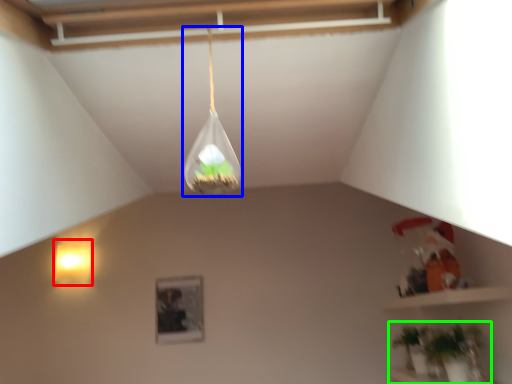
Question: Which is nearer to the lamp (highlighted by a red box)? lamp (highlighted by a blue box) or houseplant (highlighted by a green box).

Choices:
 (A) lamp
 (B) houseplant

Answer: (B)